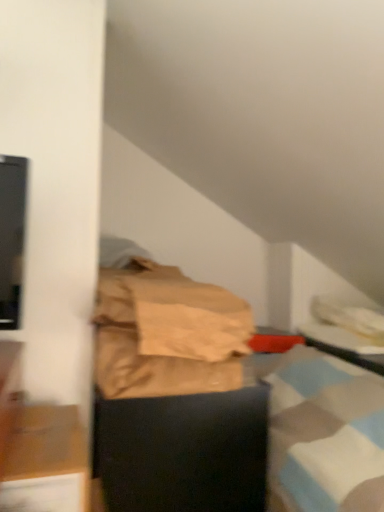
Question: From a real-world perspective, is wooden cabinet at lower left, marked as the 2th furniture in a back-to-front arrangement, located beneath brown paper bag at center?

Choices:
 (A) no
 (B) yes

Answer: (B)

Question: From a real-world perspective, is wooden cabinet at lower left, which appears as the first furniture when viewed from the front, positioned over brown paper bag at center based on gravity?

Choices:
 (A) yes
 (B) no

Answer: (B)

Question: Is wooden cabinet at lower left, marked as the 2th furniture in a back-to-front arrangement, positioned before brown paper bag at center?

Choices:
 (A) yes
 (B) no

Answer: (A)

Question: Considering the relative sizes of wooden cabinet at lower left, marked as the 2th furniture in a back-to-front arrangement, and brown paper bag at center in the image provided, is wooden cabinet at lower left, marked as the 2th furniture in a back-to-front arrangement, smaller than brown paper bag at center?

Choices:
 (A) yes
 (B) no

Answer: (A)

Question: Does wooden cabinet at lower left, marked as the 2th furniture in a back-to-front arrangement, lie behind brown paper bag at center?

Choices:
 (A) yes
 (B) no

Answer: (B)

Question: Is black matte box at center, positioned as the 1th furniture in back-to-front order, in front of or behind black glossy table at right in the image?

Choices:
 (A) front
 (B) behind

Answer: (A)

Question: Considering the positions of black matte box at center, placed as the 2th furniture when sorted from front to back, and black glossy table at right in the image, is black matte box at center, placed as the 2th furniture when sorted from front to back, wider or thinner than black glossy table at right?

Choices:
 (A) thin
 (B) wide

Answer: (B)

Question: Is black matte box at center, placed as the 2th furniture when sorted from front to back, taller or shorter than black glossy table at right?

Choices:
 (A) short
 (B) tall

Answer: (B)

Question: Considering the relative positions of black matte box at center, placed as the 2th furniture when sorted from front to back, and black glossy table at right in the image provided, is black matte box at center, placed as the 2th furniture when sorted from front to back, to the left or to the right of black glossy table at right?

Choices:
 (A) right
 (B) left

Answer: (B)

Question: Considering the positions of black glossy table at right and black matte box at center, placed as the 2th furniture when sorted from front to back, in the image, is black glossy table at right taller or shorter than black matte box at center, placed as the 2th furniture when sorted from front to back,?

Choices:
 (A) tall
 (B) short

Answer: (B)

Question: From a real-world perspective, is black glossy table at right above or below black matte box at center, placed as the 2th furniture when sorted from front to back?

Choices:
 (A) below
 (B) above

Answer: (B)

Question: Is black glossy table at right inside or outside of black matte box at center, placed as the 2th furniture when sorted from front to back?

Choices:
 (A) outside
 (B) inside

Answer: (A)

Question: Looking at the image, does black glossy table at right seem bigger or smaller compared to black matte box at center, positioned as the 1th furniture in back-to-front order?

Choices:
 (A) small
 (B) big

Answer: (A)

Question: From the image's perspective, is black glossy table at right positioned above or below wooden cabinet at lower left, marked as the 2th furniture in a back-to-front arrangement?

Choices:
 (A) below
 (B) above

Answer: (B)

Question: Does point tap(377, 365) appear closer or farther from the camera than point tap(36, 450)?

Choices:
 (A) farther
 (B) closer

Answer: (A)